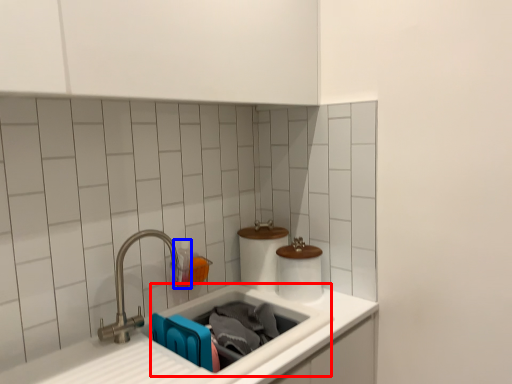
Question: Among these objects, which one is farthest to the camera, sink (highlighted by a red box) or toiletry (highlighted by a blue box)?

Choices:
 (A) sink
 (B) toiletry

Answer: (B)